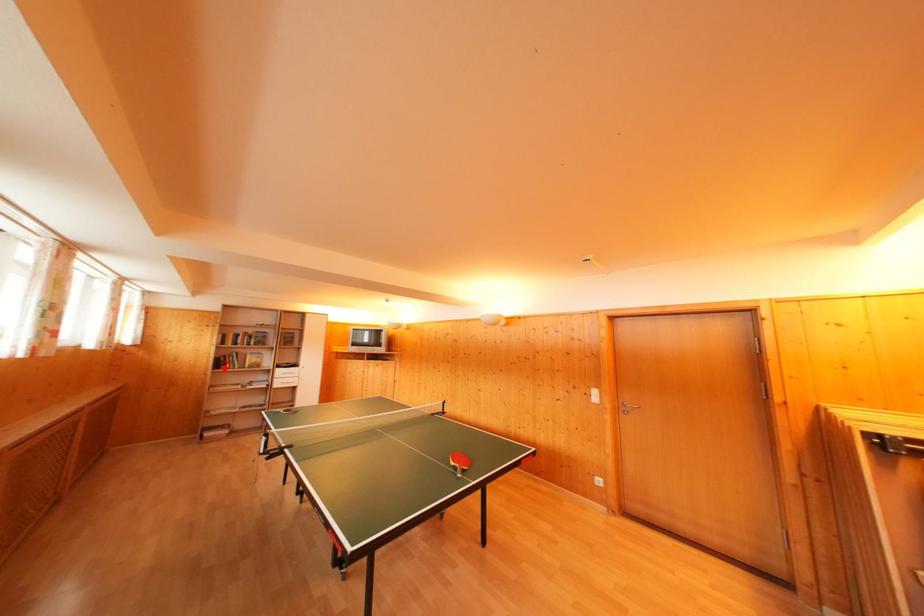
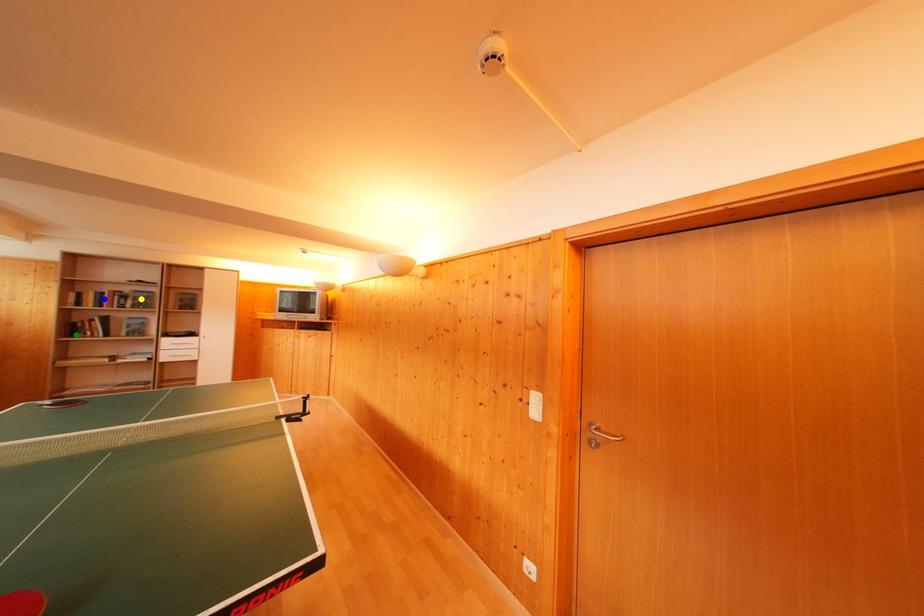
Question: I am providing you with two images of the same scene from different viewpoints. A red point is marked on the first image. You are given multiple points on the second image. In image 2, which mark is for the same physical point as the one in image 1?

Choices:
 (A) green point
 (B) blue point
 (C) yellow point

Answer: (A)